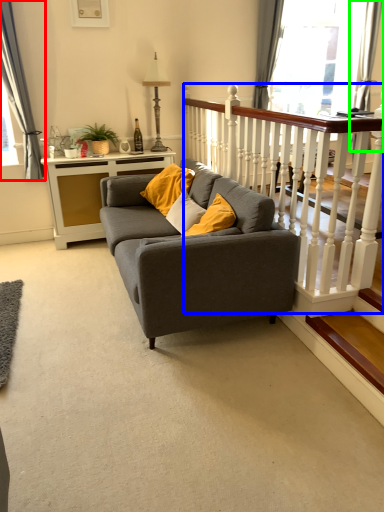
Question: Based on their relative distances, which object is nearer to curtain (highlighted by a red box)? Choose from balustrade (highlighted by a blue box) and curtain (highlighted by a green box).

Choices:
 (A) balustrade
 (B) curtain

Answer: (A)